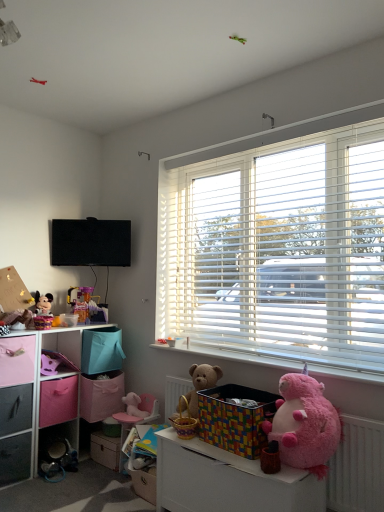
Question: From a real-world perspective, is metallic gray drawer at lower left, the second drawer positioned from the left, on matte gray drawer at lower left, which is the 3th drawer in left-to-right order?

Choices:
 (A) yes
 (B) no

Answer: (A)

Question: Is metallic gray drawer at lower left, the 2th drawer positioned from the right, outside of matte gray drawer at lower left, positioned as the 1th drawer in right-to-left order?

Choices:
 (A) no
 (B) yes

Answer: (B)

Question: Considering the relative positions of metallic gray drawer at lower left, the 2th drawer positioned from the right, and matte gray drawer at lower left, positioned as the 1th drawer in right-to-left order, in the image provided, is metallic gray drawer at lower left, the 2th drawer positioned from the right, to the left of matte gray drawer at lower left, positioned as the 1th drawer in right-to-left order, from the viewer's perspective?

Choices:
 (A) yes
 (B) no

Answer: (A)

Question: Considering the relative sizes of metallic gray drawer at lower left, the 2th drawer positioned from the right, and matte gray drawer at lower left, positioned as the 1th drawer in right-to-left order, in the image provided, is metallic gray drawer at lower left, the 2th drawer positioned from the right, bigger than matte gray drawer at lower left, positioned as the 1th drawer in right-to-left order,?

Choices:
 (A) yes
 (B) no

Answer: (A)

Question: Does metallic gray drawer at lower left, the 2th drawer positioned from the right, have a lesser width compared to matte gray drawer at lower left, positioned as the 1th drawer in right-to-left order?

Choices:
 (A) no
 (B) yes

Answer: (A)

Question: Is metallic gray drawer at lower left, the 2th drawer positioned from the right, positioned before matte gray drawer at lower left, positioned as the 1th drawer in right-to-left order?

Choices:
 (A) yes
 (B) no

Answer: (A)

Question: Can you confirm if fuzzy pink teddy bear at lower right, arranged as the 1th teddy bear when viewed from the front, is positioned to the right of pink fabric storage box at left, which is the first storage box in left-to-right order?

Choices:
 (A) no
 (B) yes

Answer: (B)

Question: Considering the relative sizes of fuzzy pink teddy bear at lower right, which is the first teddy bear in right-to-left order, and pink fabric storage box at left, placed as the second storage box when sorted from front to back, in the image provided, is fuzzy pink teddy bear at lower right, which is the first teddy bear in right-to-left order, smaller than pink fabric storage box at left, placed as the second storage box when sorted from front to back,?

Choices:
 (A) no
 (B) yes

Answer: (A)

Question: Is fuzzy pink teddy bear at lower right, arranged as the 1th teddy bear when viewed from the front, located outside pink fabric storage box at left, which is counted as the second storage box, starting from the right?

Choices:
 (A) no
 (B) yes

Answer: (B)

Question: Is fuzzy pink teddy bear at lower right, arranged as the 1th teddy bear when viewed from the front, oriented away from pink fabric storage box at left, placed as the second storage box when sorted from front to back?

Choices:
 (A) no
 (B) yes

Answer: (A)

Question: Is fuzzy pink teddy bear at lower right, arranged as the 1th teddy bear when viewed from the front, wider than pink fabric storage box at left, which is counted as the second storage box, starting from the right?

Choices:
 (A) no
 (B) yes

Answer: (A)

Question: From the image's perspective, does fuzzy pink teddy bear at lower right, arranged as the second teddy bear when viewed from the left, appear lower than pink fabric storage box at left, placed as the second storage box when sorted from front to back?

Choices:
 (A) yes
 (B) no

Answer: (A)

Question: Is white plastic radiator at lower right facing away from white plastic window sill at lower center?

Choices:
 (A) no
 (B) yes

Answer: (A)